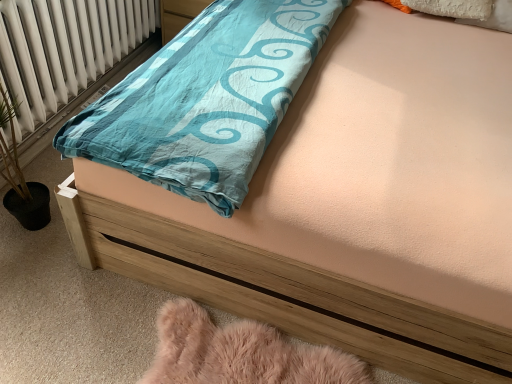
Question: From a real-world perspective, relative to white radiator at left, is fuzzy pink rug at lower left vertically above or below?

Choices:
 (A) above
 (B) below

Answer: (B)

Question: Is fuzzy pink rug at lower left to the left or to the right of white radiator at left in the image?

Choices:
 (A) left
 (B) right

Answer: (B)

Question: From their relative heights in the image, would you say fuzzy pink rug at lower left is taller or shorter than white radiator at left?

Choices:
 (A) tall
 (B) short

Answer: (B)

Question: In terms of height, does white radiator at left look taller or shorter compared to fuzzy pink rug at lower left?

Choices:
 (A) tall
 (B) short

Answer: (A)

Question: Looking at the image, does white radiator at left seem bigger or smaller compared to fuzzy pink rug at lower left?

Choices:
 (A) big
 (B) small

Answer: (A)

Question: From a real-world perspective, is white radiator at left positioned above or below fuzzy pink rug at lower left?

Choices:
 (A) below
 (B) above

Answer: (B)

Question: Considering their positions, is white radiator at left located in front of or behind fuzzy pink rug at lower left?

Choices:
 (A) front
 (B) behind

Answer: (B)